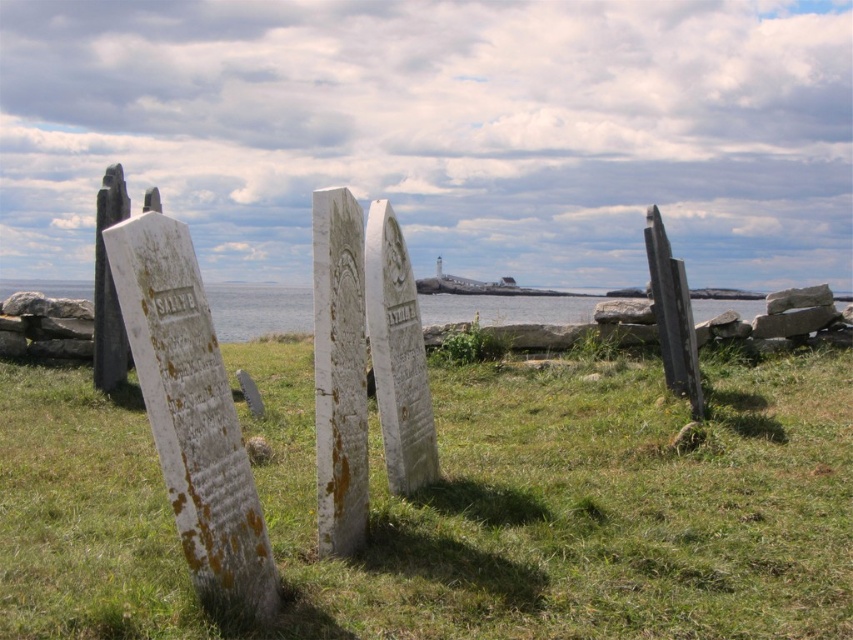
Which is in front, point (264, 397) or point (254, 323)?

Point (264, 397) is in front.

What do you see at coordinates (578, 506) in the screenshot? I see `green grass at center` at bounding box center [578, 506].

Between point (735, 369) and point (494, 317), which one is positioned in front?

Point (735, 369) is in front.

Find the location of a particular element. green grass at center is located at coordinates (578, 506).